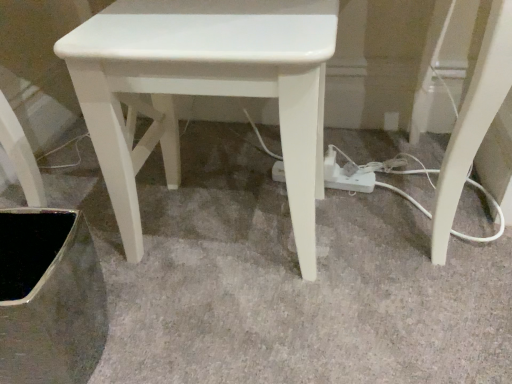
This screenshot has height=384, width=512. What do you see at coordinates (203, 89) in the screenshot?
I see `white matte stool at center` at bounding box center [203, 89].

At what (x,y) coordinates should I click in order to perform the action: click on white matte stool at center. Please return your answer as a coordinate pair (x, y). Looking at the image, I should click on (203, 89).

Find the location of a particular element. white plastic extension cord at lower center is located at coordinates (352, 182).

The image size is (512, 384). What do you see at coordinates (352, 182) in the screenshot?
I see `white plastic extension cord at lower center` at bounding box center [352, 182].

What are the coordinates of `white matte stool at center` in the screenshot? It's located at (203, 89).

Visually, is white plastic extension cord at lower center positioned to the left or to the right of white matte stool at center?

Clearly, white plastic extension cord at lower center is on the right of white matte stool at center in the image.

Relative to white matte stool at center, is white plastic extension cord at lower center in front or behind?

Clearly, white plastic extension cord at lower center is behind white matte stool at center.

Is point (276, 173) positioned before point (168, 16)?

No, it is behind (168, 16).

From the image's perspective, would you say white plastic extension cord at lower center is positioned over white matte stool at center?

No, from the image's perspective, white plastic extension cord at lower center is not above white matte stool at center.

From a real-world perspective, is white plastic extension cord at lower center located higher than white matte stool at center?

No, from a real-world perspective, white plastic extension cord at lower center is not over white matte stool at center

Is white plastic extension cord at lower center wider than white matte stool at center?

Incorrect, the width of white plastic extension cord at lower center does not surpass that of white matte stool at center.

Is white plastic extension cord at lower center taller or shorter than white matte stool at center?

In the image, white plastic extension cord at lower center appears to be shorter than white matte stool at center.

Based on the photo, between white plastic extension cord at lower center and white matte stool at center, which one has larger size?

Bigger between the two is white matte stool at center.

Is white matte stool at center completely or partially inside white plastic extension cord at lower center?

Actually, white matte stool at center is outside white plastic extension cord at lower center.

Is white plastic extension cord at lower center placed right next to white matte stool at center?

No, white plastic extension cord at lower center is not touching white matte stool at center.

Is white plastic extension cord at lower center positioned with its back to white matte stool at center?

No, white matte stool at center is not at the back of white plastic extension cord at lower center.

Can you tell me how much white plastic extension cord at lower center and white matte stool at center differ in facing direction?

5.97 degrees separate the facing orientations of white plastic extension cord at lower center and white matte stool at center.

You are a GUI agent. You are given a task and a screenshot of the screen. Output one action in this format:
    pyautogui.click(x=<x>, y=<y>)
    Task: Click on the extension cord below the white matte stool at center (from a real-world perspective)
    The width and height of the screenshot is (512, 384).
    Given the screenshot: What is the action you would take?
    pyautogui.click(x=352, y=182)

Based on their positions, is white matte stool at center located to the left or right of white plastic extension cord at lower center?

Based on their positions, white matte stool at center is located to the left of white plastic extension cord at lower center.

Which object is closer to the camera, white matte stool at center or white plastic extension cord at lower center?

white matte stool at center.

Is point (254, 86) behind point (341, 177)?

No, it is in front of (341, 177).

From the image's perspective, is white matte stool at center below white plastic extension cord at lower center?

Incorrect, from the image's perspective, white matte stool at center is higher than white plastic extension cord at lower center.

From a real-world perspective, who is located higher, white matte stool at center or white plastic extension cord at lower center?

In real-world perspective, white matte stool at center is above.

Can you confirm if white matte stool at center is wider than white plastic extension cord at lower center?

Indeed, white matte stool at center has a greater width compared to white plastic extension cord at lower center.

Who is shorter, white matte stool at center or white plastic extension cord at lower center?

white plastic extension cord at lower center is shorter.

In terms of size, does white matte stool at center appear bigger or smaller than white plastic extension cord at lower center?

In the image, white matte stool at center appears to be larger than white plastic extension cord at lower center.

Would you say white plastic extension cord at lower center is part of white matte stool at center's contents?

Definitely not — white plastic extension cord at lower center is not inside white matte stool at center.

Is white matte stool at center far from white plastic extension cord at lower center?

No, white matte stool at center is not far from white plastic extension cord at lower center.

Is white matte stool at center facing away from white plastic extension cord at lower center?

Yes, white matte stool at center is positioned with its back facing white plastic extension cord at lower center.

From the picture: How different are the orientations of white matte stool at center and white plastic extension cord at lower center in degrees?

They differ by 5.97 degrees in their facing directions.

The width and height of the screenshot is (512, 384). I want to click on stool that is in front of the white plastic extension cord at lower center, so click(203, 89).

Where is `stool that appears in front of the white plastic extension cord at lower center`? Image resolution: width=512 pixels, height=384 pixels. stool that appears in front of the white plastic extension cord at lower center is located at coordinates (203, 89).

Locate an element on the screen. This screenshot has height=384, width=512. extension cord below the white matte stool at center (from a real-world perspective) is located at coordinates (352, 182).